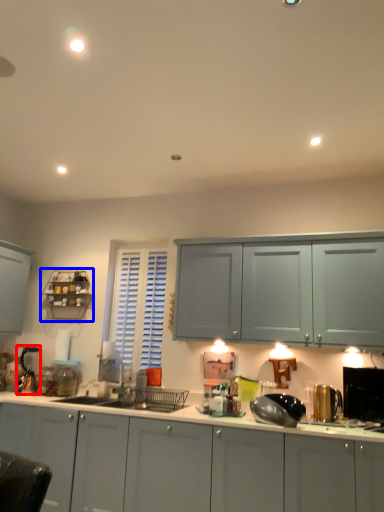
Question: Which point is closer to the camera, appliance (highlighted by a red box) or shelf (highlighted by a blue box)?

Choices:
 (A) appliance
 (B) shelf

Answer: (A)